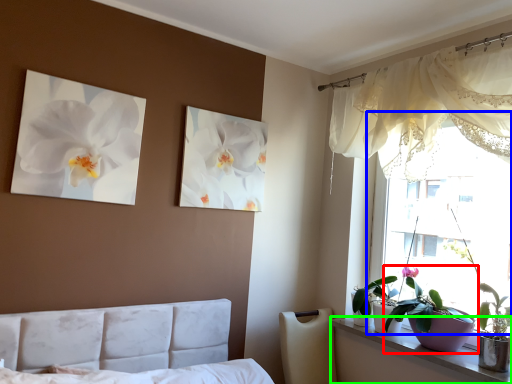
Question: Which object is positioned closest to houseplant (highlighted by a red box)? Select from window (highlighted by a blue box) and window sill (highlighted by a green box).

Choices:
 (A) window
 (B) window sill

Answer: (B)